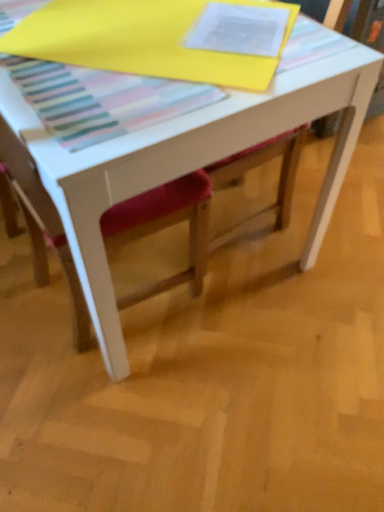
At what (x,y) coordinates should I click in order to perform the action: click on free space above white matte table at center (from a real-world perspective). Please return your answer as a coordinate pair (x, y). Image resolution: width=384 pixels, height=512 pixels. Looking at the image, I should click on 133,37.